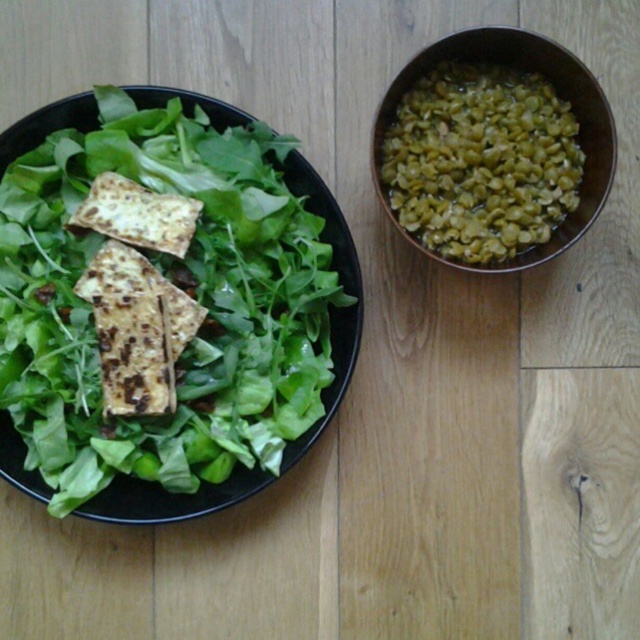
Question: Where is green leafymaterial/texturevegetable at left located in relation to green matte bowl at upper right in the image?

Choices:
 (A) below
 (B) above

Answer: (A)

Question: Which of the following is the farthest from the observer?

Choices:
 (A) (492, 29)
 (B) (176, 508)

Answer: (B)

Question: Does green leafymaterial/texturevegetable at left have a lesser width compared to green matte bowl at upper right?

Choices:
 (A) no
 (B) yes

Answer: (A)

Question: Which of the following is the closest to the observer?

Choices:
 (A) green matte bowl at upper right
 (B) green leafymaterial/texturevegetable at left

Answer: (A)

Question: Can you confirm if green leafymaterial/texturevegetable at left is smaller than green matte bowl at upper right?

Choices:
 (A) no
 (B) yes

Answer: (A)